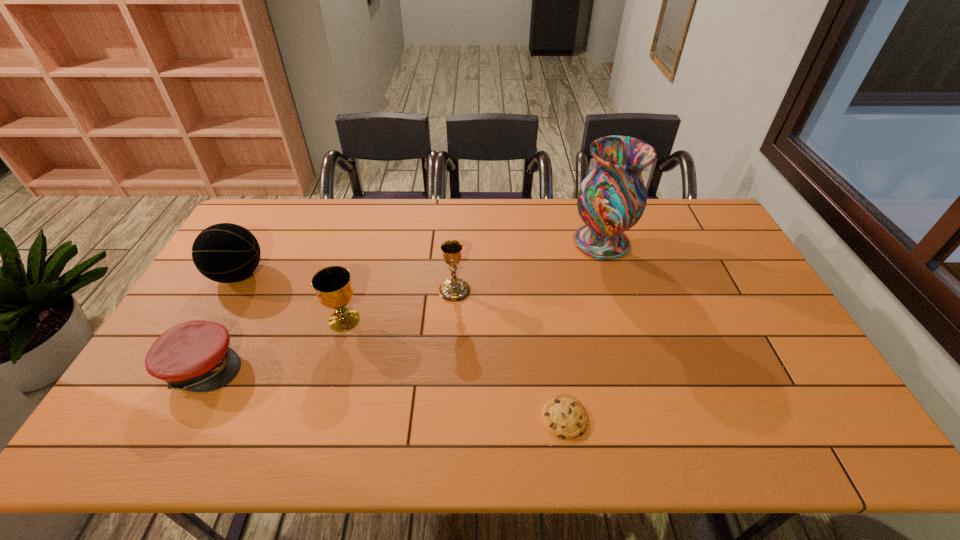
This screenshot has height=540, width=960. In the image, there is a desktop. Find the location of `vacant space at the far edge`. vacant space at the far edge is located at coordinates (453, 208).

Find the location of a particular element. This screenshot has height=540, width=960. vacant space at the left edge is located at coordinates (204, 297).

This screenshot has width=960, height=540. Find the location of `blank area at the right edge`. blank area at the right edge is located at coordinates (787, 392).

Where is `vacant area at the far right corner of the desktop`? The image size is (960, 540). vacant area at the far right corner of the desktop is located at coordinates (677, 220).

Where is `free spot between the basketball and the fourth object from right to left`? The image size is (960, 540). free spot between the basketball and the fourth object from right to left is located at coordinates (291, 298).

Where is `free space between the basketball and the rightmost object`? free space between the basketball and the rightmost object is located at coordinates (420, 259).

Find the location of `free space between the left chalice and the third object from right to left`. free space between the left chalice and the third object from right to left is located at coordinates (399, 305).

Image resolution: width=960 pixels, height=540 pixels. I want to click on free space between the fifth object from left to right and the cap, so tap(384, 392).

Image resolution: width=960 pixels, height=540 pixels. Identify the location of free space between the farther chalice and the second object from right to left. (510, 354).

Where is `vacant area that lies between the basketball and the cookie`? The image size is (960, 540). vacant area that lies between the basketball and the cookie is located at coordinates (401, 346).